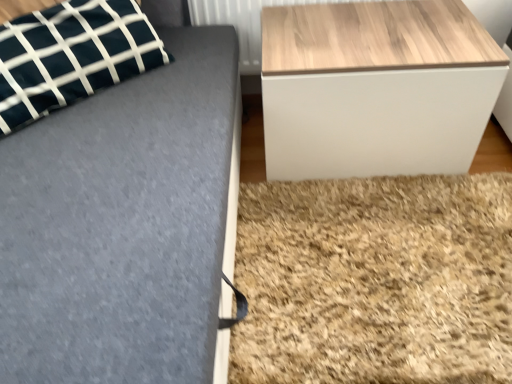
Question: Does point (395, 140) appear closer or farther from the camera than point (133, 44)?

Choices:
 (A) closer
 (B) farther

Answer: (B)

Question: From a real-world perspective, relative to dark green fabric pillow at upper left, is wooden/textured table at right vertically above or below?

Choices:
 (A) above
 (B) below

Answer: (B)

Question: Which object is the closest to the wooden radiator at upper right?

Choices:
 (A) wooden/textured table at right
 (B) dark green fabric pillow at upper left

Answer: (A)

Question: Which of these objects is positioned farthest from the wooden/textured table at right?

Choices:
 (A) dark green fabric pillow at upper left
 (B) wooden radiator at upper right

Answer: (A)